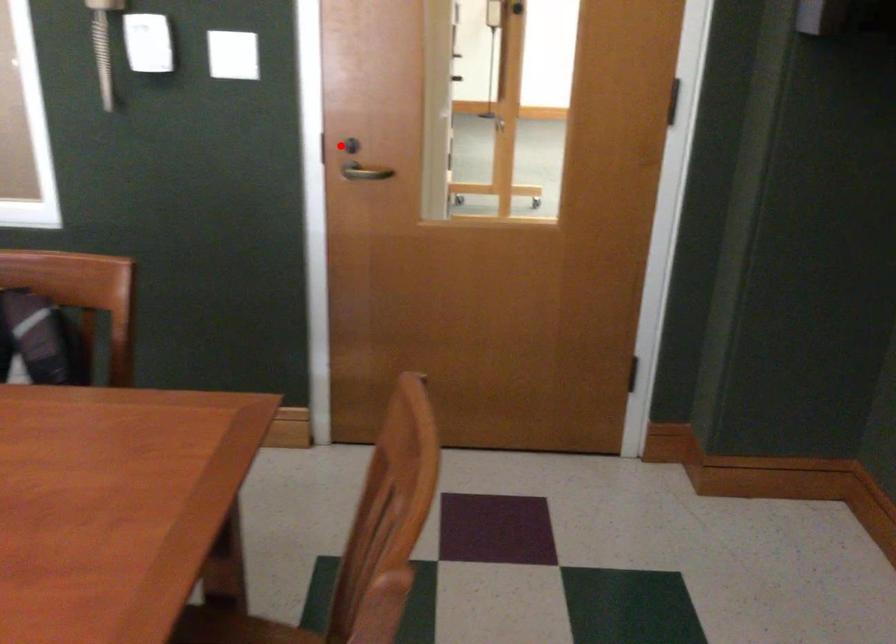
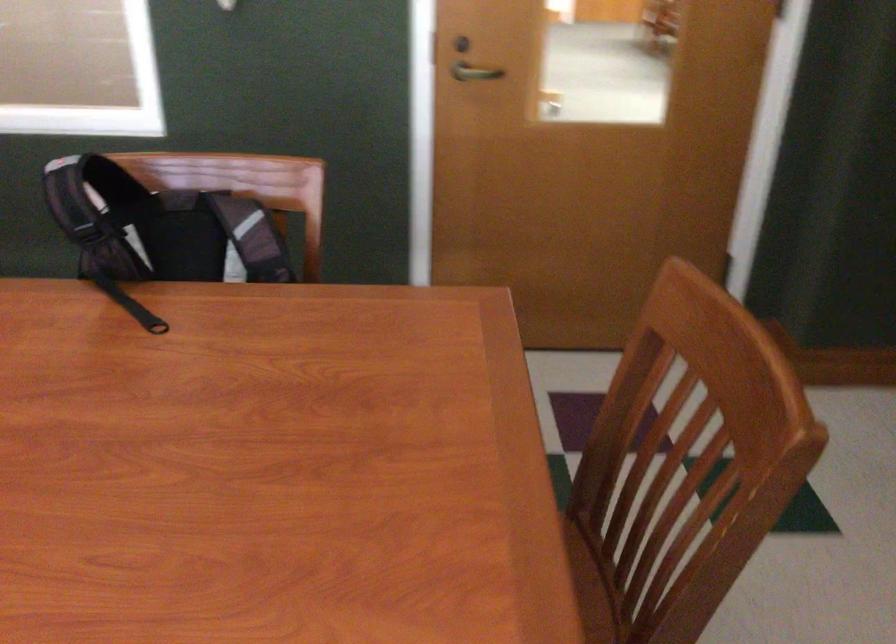
Where in the second image is the point corresponding to the highlighted location from the first image?

(460, 44)